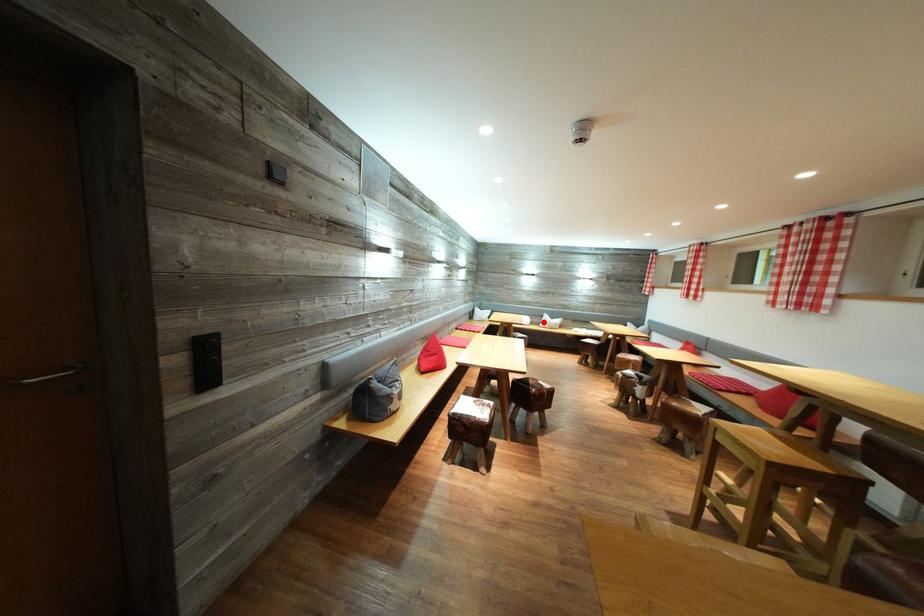
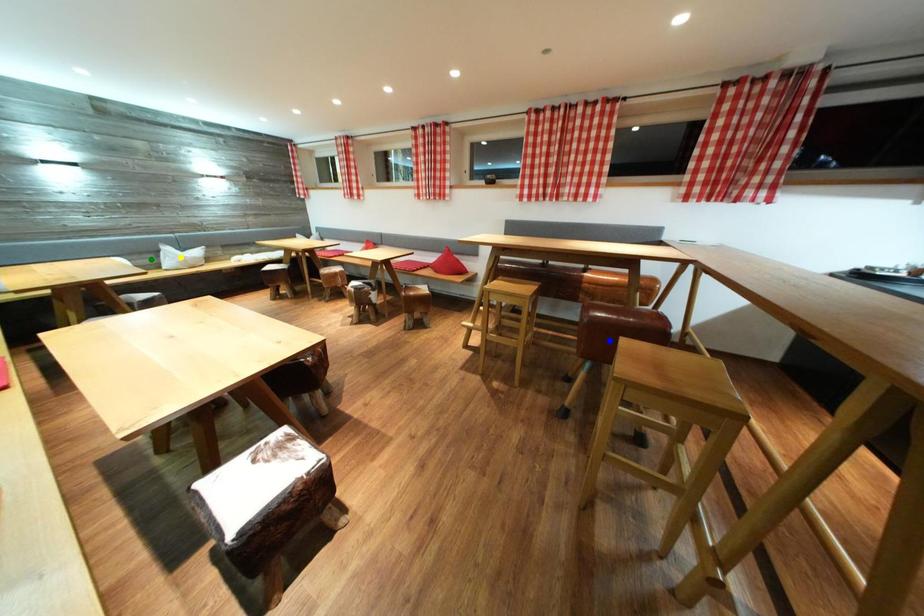
Question: I am providing you with two images of the same scene from different viewpoints. A red point is marked on the first image. You are given multiple points on the second image. Which spot in image 2 lines up with the point in image 1?

Choices:
 (A) yellow point
 (B) blue point
 (C) green point

Answer: (C)